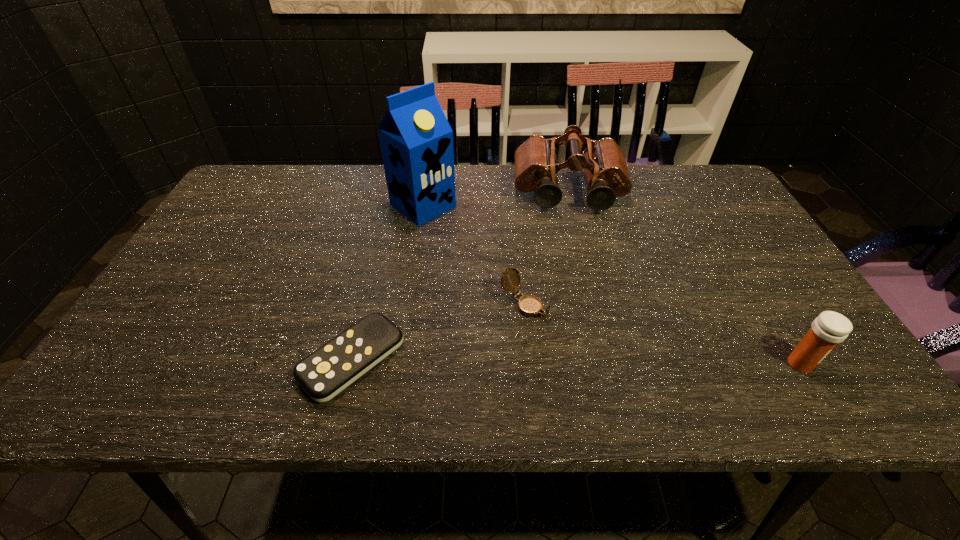
The image size is (960, 540). I want to click on vacant space on the desktop that is between the shortest object and the third tallest object and is positioned on the face of the second shortest object, so click(611, 362).

The image size is (960, 540). I want to click on vacant spot on the desktop that is between the shortest object and the third tallest object and is positioned through the eyepieces of the binoculars, so click(x=588, y=361).

This screenshot has width=960, height=540. Find the location of `free spot on the desktop that is between the remote control and the medicine and is positioned with the cap open on the carton`. free spot on the desktop that is between the remote control and the medicine and is positioned with the cap open on the carton is located at coordinates (641, 362).